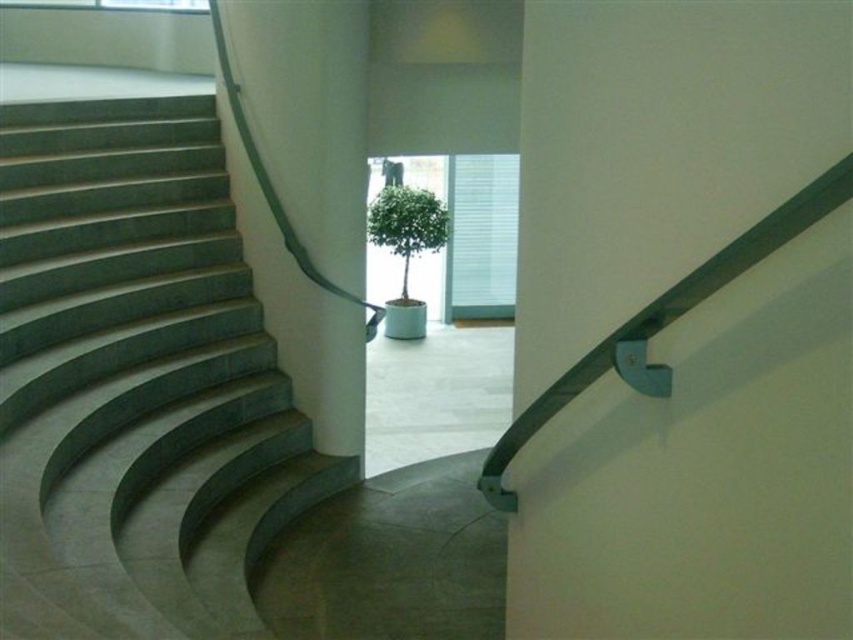
You are standing in front of the staircase and want to reach a potted plant visible through the large window. The point you need to reach is marked as point (639,328). Given that your arm can extend up to 2.5 feet, can you reach the point without moving closer?

The distance of point (639,328) from viewer is 5.49 feet. Since your arm can only extend up to 2.5 feet, you cannot reach the point without moving closer.

You are standing at the bottom of the staircase and want to reach the green matte handrail at upper right. There is a white smooth pillar at center in your path. Based on the scene, can you determine if you need to go around the pillar to reach the handrail?

The green matte handrail at upper right is below the white smooth pillar at center, so you would need to go around the pillar to reach the handrail since it is blocking the direct path.

You are a maintenance worker needing to reach the green matte handrail at upper right from the green polished concrete stairs at left. Given that your ladder is 8 feet long, can you safely reach the handrail without extending it further?

The distance between the green polished concrete stairs at left and the green matte handrail at upper right is 8.56 feet. Since the ladder is only 8 feet long, it is not long enough to safely reach the handrail without extending it further.